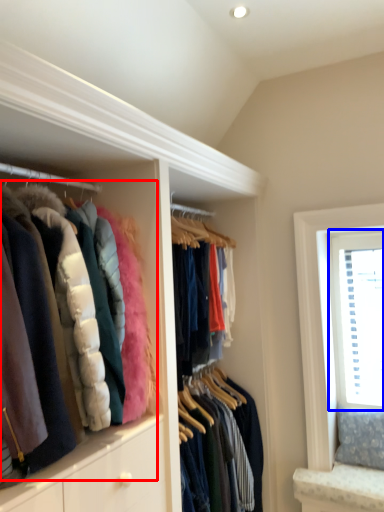
Question: Among these objects, which one is nearest to the camera, jacket (highlighted by a red box) or window (highlighted by a blue box)?

Choices:
 (A) jacket
 (B) window

Answer: (A)